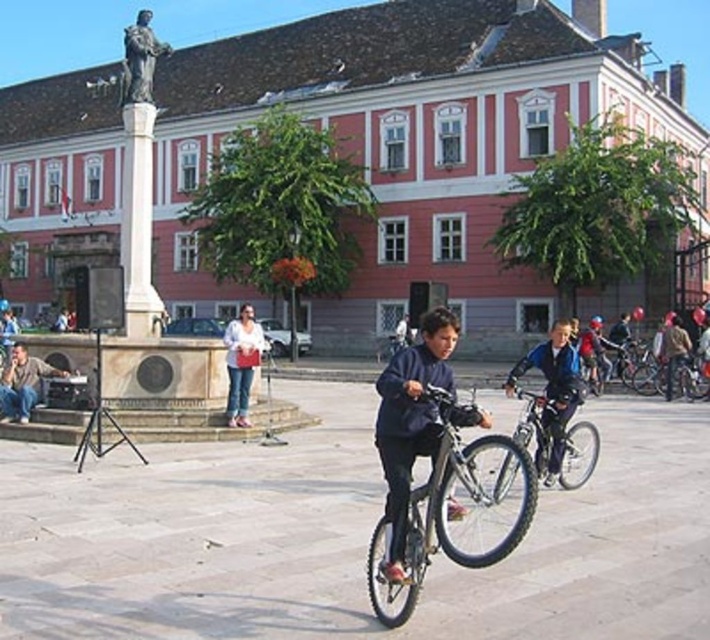
Question: Which is nearer to the dark blue fabric jacket at center?

Choices:
 (A) matte black jacket at lower left
 (B) dark blue jacket at center

Answer: (B)

Question: Does white marble column at center have a larger size compared to blue denim jacket at center?

Choices:
 (A) no
 (B) yes

Answer: (B)

Question: Among these points, which one is farthest from the camera?

Choices:
 (A) (23, 416)
 (B) (393, 550)
 (C) (666, 339)

Answer: (C)

Question: Which of the following is the closest to the observer?

Choices:
 (A) white marble column at center
 (B) denim jacket at center

Answer: (A)

Question: Is white marble column at center below brown leather jacket at lower right?

Choices:
 (A) yes
 (B) no

Answer: (B)

Question: Is brown leather jacket at lower right further to the viewer compared to blue denim jacket at center?

Choices:
 (A) no
 (B) yes

Answer: (A)